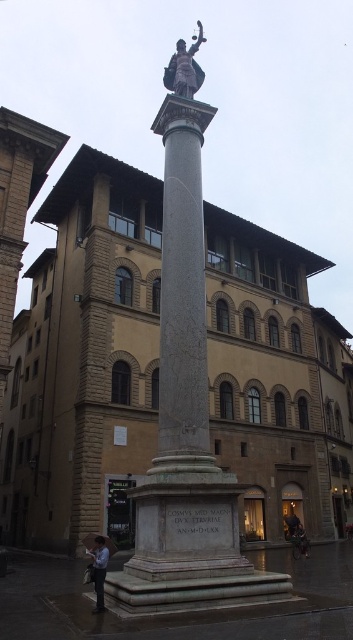
Does polished bronze statue at upper center appear on the right side of dark gray jacket at lower right?

No, polished bronze statue at upper center is not to the right of dark gray jacket at lower right.

Consider the image. Can you confirm if polished bronze statue at upper center is smaller than dark gray jacket at lower right?

No.

Describe the element at coordinates (184, 67) in the screenshot. I see `polished bronze statue at upper center` at that location.

Identify the location of polished bronze statue at upper center. This screenshot has width=353, height=640. (184, 67).

Which is in front, point (100, 552) or point (308, 548)?

Positioned in front is point (100, 552).

Does white cotton shirt at lower left have a lesser width compared to dark gray jacket at lower right?

No, white cotton shirt at lower left is not thinner than dark gray jacket at lower right.

Does point (104, 580) lie behind point (300, 540)?

No, it is in front of (300, 540).

The image size is (353, 640). I want to click on white cotton shirt at lower left, so (x=98, y=570).

Can you confirm if polished bronze statue at upper center is positioned to the right of white cotton shirt at lower left?

Indeed, polished bronze statue at upper center is positioned on the right side of white cotton shirt at lower left.

Which is in front, point (164, 77) or point (96, 588)?

Positioned in front is point (96, 588).

Between point (176, 92) and point (93, 579), which one is positioned in front?

Point (93, 579)

Identify the location of polished bronze statue at upper center. (184, 67).